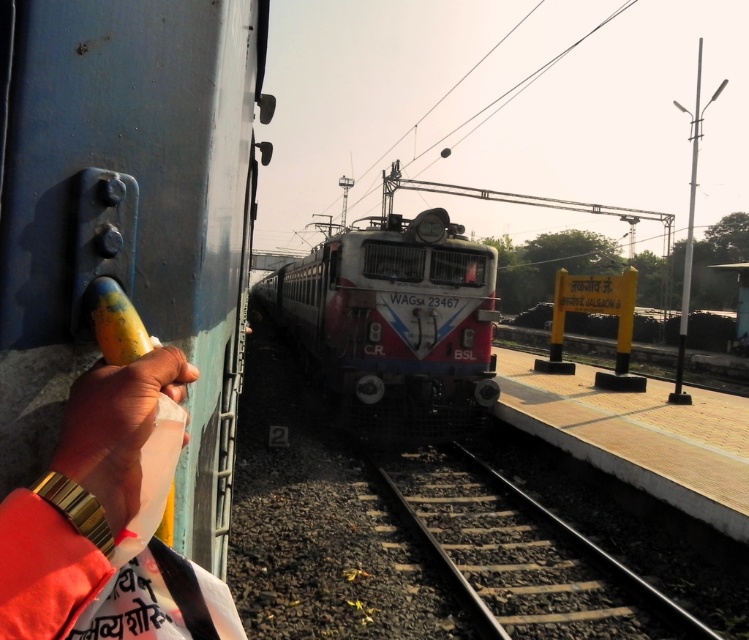
You are a railway engineer inspecting the tracks. You need to determine if the white glossy train at center is positioned correctly according to the safety protocol that requires all trains to be centered at exactly point 0.5 on both the x and y axes. Is the train properly aligned?

The white glossy train at center is located at point (x=394, y=324), which is very close to the required 0.5 on both axes. According to safety protocols, this slight deviation is within acceptable tolerance limits, so the train is considered properly aligned.

You are a maintenance worker who needs to inspect the white glossy train at center and the smooth metal train track at center. The safety protocol requires a minimum distance of 5 meters between the train and the track during inspection. Can you proceed with the inspection according to the safety guidelines?

The white glossy train at center is 5.54 meters from the smooth metal train track at center. Since 5.54 meters is greater than the required 5 meters, the safety protocol is satisfied. Therefore, you can proceed with the inspection.

You are a passenger waiting at the railway station platform. You notice a gold watch at left and a smooth yellow banana at left. Which object is closer to the left edge of the platform?

The gold watch at left is closer to the left edge of the platform since it is positioned to the left of the smooth yellow banana at left.